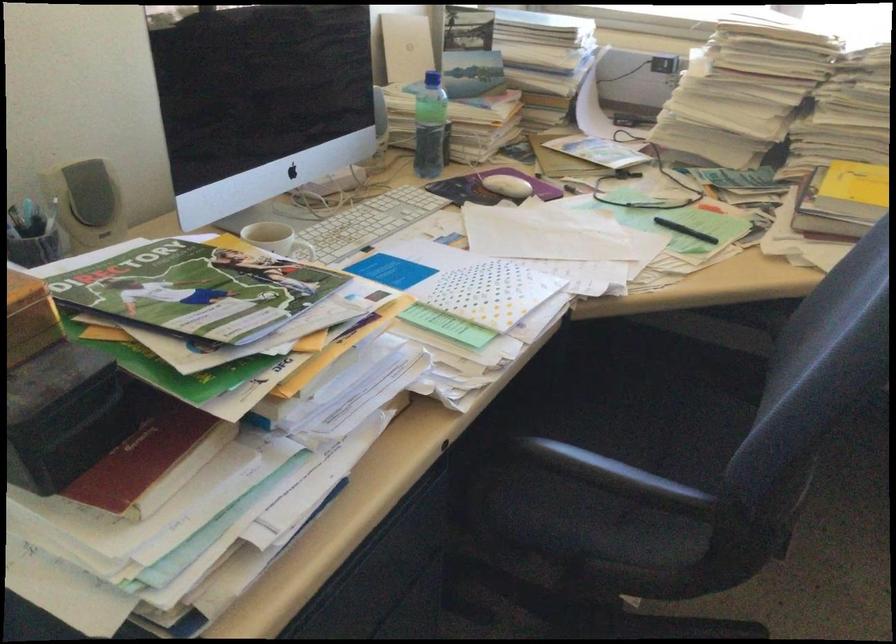
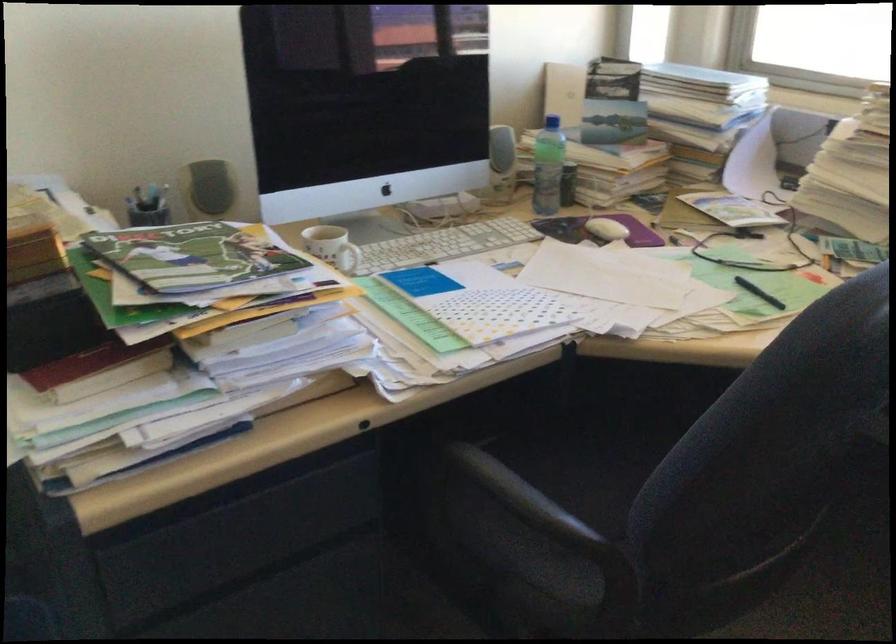
Where in the second image is the point corresponding to point (514, 185) from the first image?

(606, 229)